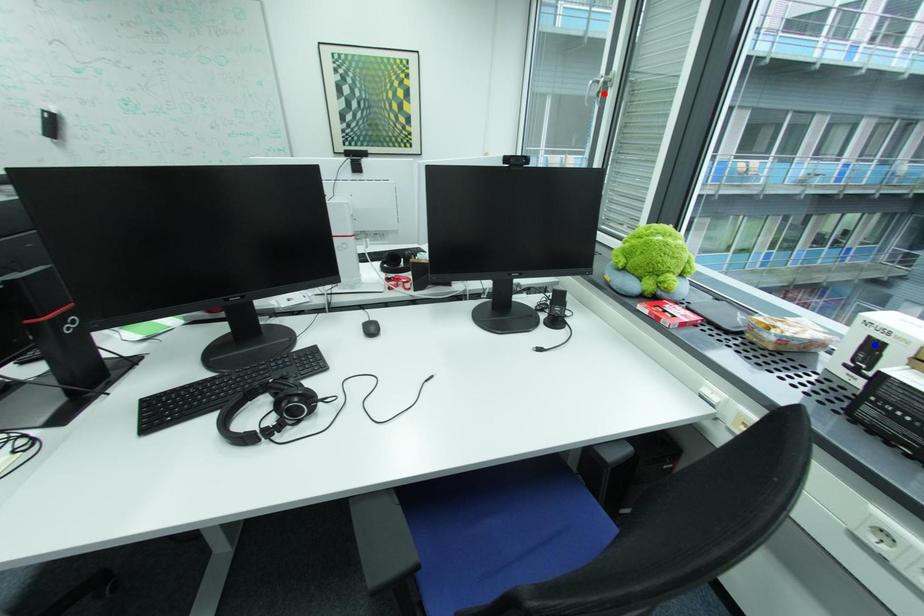
Question: In the image, two points are highlighted. Which point is nearer to the camera? Reply with the corresponding letter.

Choices:
 (A) blue point
 (B) red point

Answer: (A)